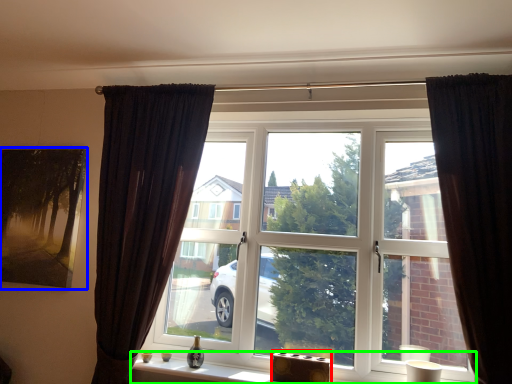
Question: Considering the real-world distances, which object is farthest from furniture (highlighted by a red box)? picture frame (highlighted by a blue box) or window sill (highlighted by a green box)?

Choices:
 (A) picture frame
 (B) window sill

Answer: (A)